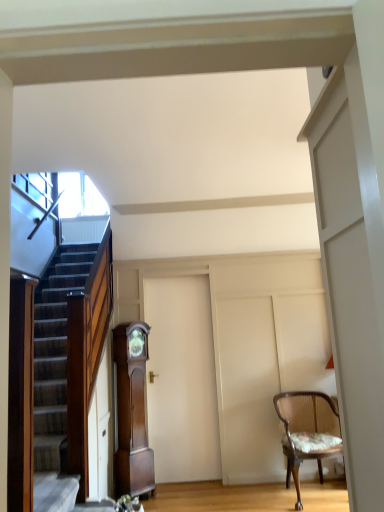
Question: Is point (296, 509) positioned closer to the camera than point (153, 352)?

Choices:
 (A) farther
 (B) closer

Answer: (B)

Question: Is wooden textured chair at right wider or thinner than white matte door at center?

Choices:
 (A) wide
 (B) thin

Answer: (A)

Question: Which of these objects is positioned closest to the wooden textured chair at right?

Choices:
 (A) mahogany wood grandfather clock at center
 (B) white matte door at center

Answer: (B)

Question: Which of these objects is positioned closest to the white matte door at center?

Choices:
 (A) wooden textured chair at right
 (B) mahogany wood grandfather clock at center

Answer: (B)